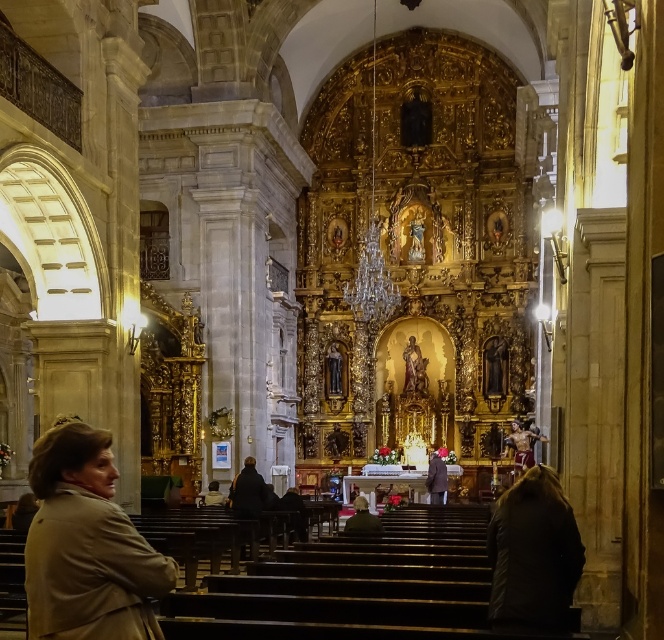
Question: Can you confirm if beige fabric coat at lower left is bigger than dark brown leather jacket at center?

Choices:
 (A) yes
 (B) no

Answer: (A)

Question: Which of the following is the closest to the observer?

Choices:
 (A) (86, 474)
 (B) (349, 522)

Answer: (A)

Question: Which object is closer to the camera taking this photo?

Choices:
 (A) dark brown leather jacket at center
 (B) beige fabric coat at lower left

Answer: (B)

Question: Where is beige fabric coat at lower left located in relation to dark brown leather coat at center in the image?

Choices:
 (A) right
 (B) left

Answer: (B)

Question: Is beige fabric coat at lower left further to the viewer compared to dark brown leather coat at center?

Choices:
 (A) no
 (B) yes

Answer: (A)

Question: Which point is farther to the camera?

Choices:
 (A) dark brown leather coat at center
 (B) beige fabric coat at lower left
 (C) dark brown leather jacket at center

Answer: (A)